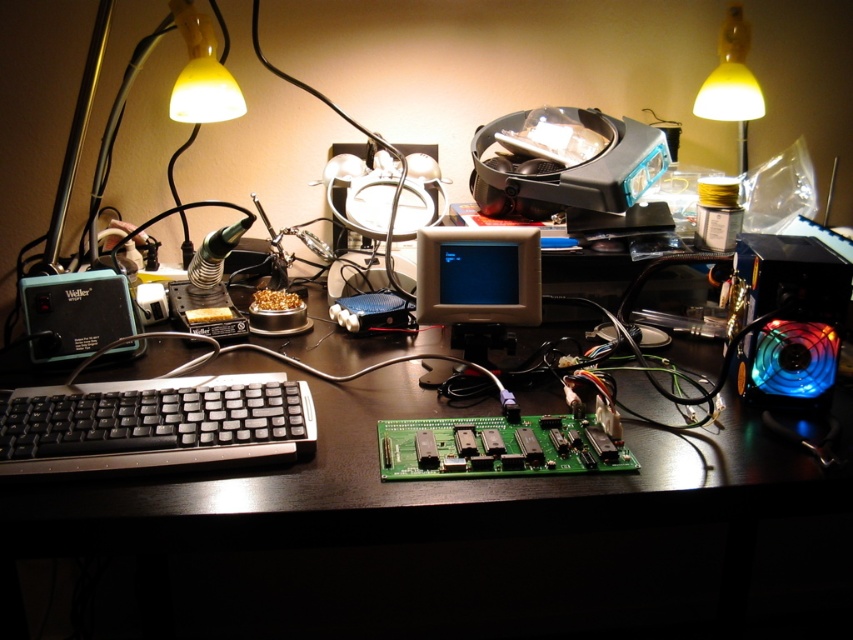
Between black plastic keyboard at lower left and matte plastic monitor at center, which one has more height?

matte plastic monitor at center is taller.

Is black plastic keyboard at lower left bigger than matte plastic monitor at center?

Indeed, black plastic keyboard at lower left has a larger size compared to matte plastic monitor at center.

Who is more distant from viewer, (141, 388) or (479, 260)?

Point (479, 260)

Locate an element on the screen. Image resolution: width=853 pixels, height=640 pixels. black plastic keyboard at lower left is located at coordinates (155, 424).